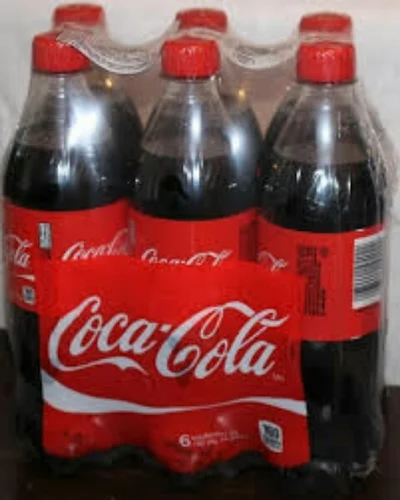
I want to click on brown table, so click(x=386, y=474).